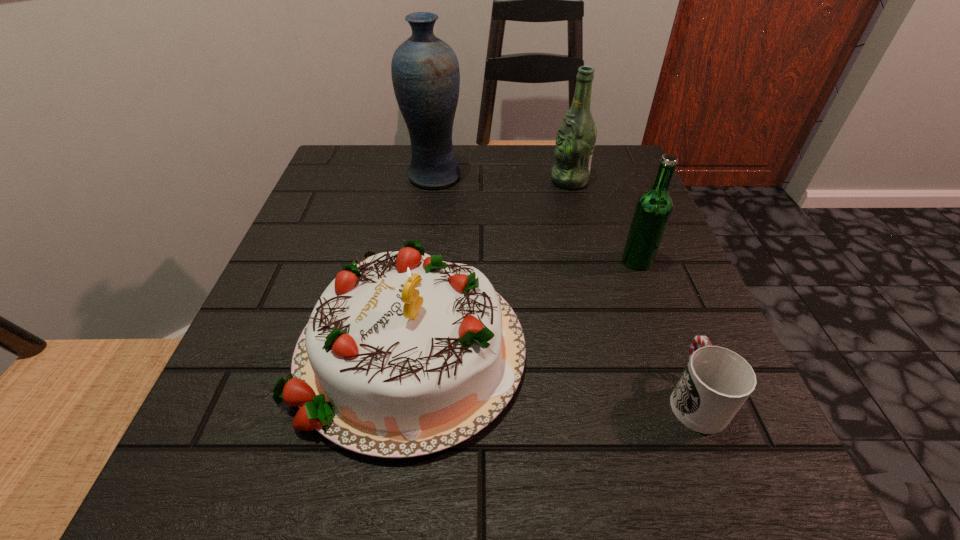
This screenshot has width=960, height=540. Find the location of `blank area located 0.090m on the surface of the farther beer bottle`. blank area located 0.090m on the surface of the farther beer bottle is located at coordinates (510, 181).

At what (x,y) coordinates should I click in order to perform the action: click on blank space located 0.260m on the front of the right beer bottle. Please return your answer as a coordinate pair (x, y). This screenshot has height=540, width=960. Looking at the image, I should click on pos(693,406).

Find the location of a particular element. This screenshot has width=960, height=540. free space located 0.150m on the right of the cake is located at coordinates (625, 346).

The image size is (960, 540). In order to click on vacant space located on the handle side of the cup in this screenshot , I will do `click(669, 332)`.

Locate an element on the screen. free space located on the handle side of the cup is located at coordinates (631, 234).

I want to click on vacant area situated 0.340m on the handle side of the cup, so click(x=626, y=221).

You are a GUI agent. You are given a task and a screenshot of the screen. Output one action in this format:
    pyautogui.click(x=<x>, y=<y>)
    Task: Click on the vase that is at the far edge
    
    Given the screenshot: What is the action you would take?
    pyautogui.click(x=425, y=72)

Locate an element on the screen. beer bottle that is positioned at the far edge is located at coordinates (576, 136).

Locate an element on the screen. Image resolution: width=960 pixels, height=540 pixels. object that is at the near edge is located at coordinates (404, 355).

This screenshot has height=540, width=960. What are the coordinates of `object at the left edge` in the screenshot? It's located at 404,355.